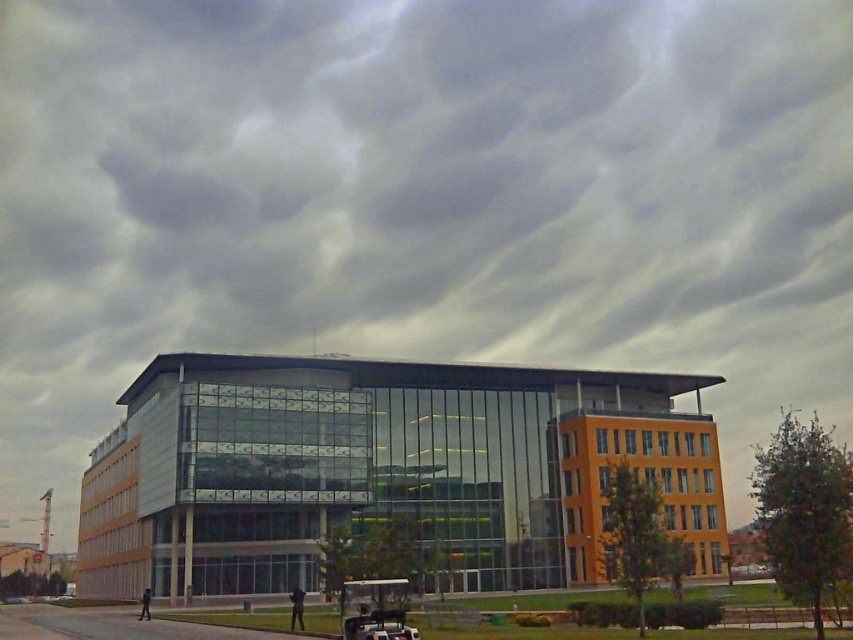
Question: Is glassy modern building at center further to the viewer compared to white plastic golf cart at lower center?

Choices:
 (A) no
 (B) yes

Answer: (B)

Question: Which object appears closest to the camera in this image?

Choices:
 (A) glassy modern building at center
 (B) white plastic golf cart at lower center

Answer: (B)

Question: Which of the following is the closest to the observer?

Choices:
 (A) white plastic golf cart at lower center
 (B) glassy modern building at center

Answer: (A)

Question: Can you confirm if glassy modern building at center is wider than white plastic golf cart at lower center?

Choices:
 (A) yes
 (B) no

Answer: (A)

Question: Is glassy modern building at center below white plastic golf cart at lower center?

Choices:
 (A) no
 (B) yes

Answer: (B)

Question: Which point appears farthest from the camera in this image?

Choices:
 (A) click(236, 540)
 (B) click(399, 596)

Answer: (A)